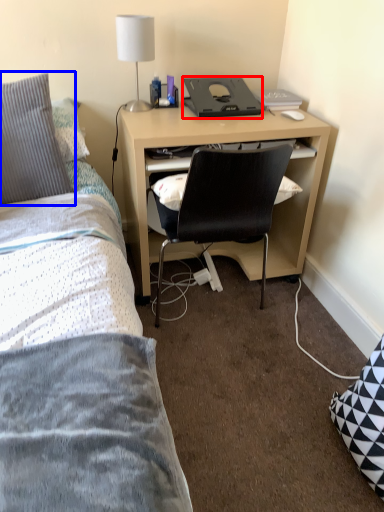
Question: Which point is closer to the camera, desktop (highlighted by a red box) or pillow (highlighted by a blue box)?

Choices:
 (A) desktop
 (B) pillow

Answer: (B)